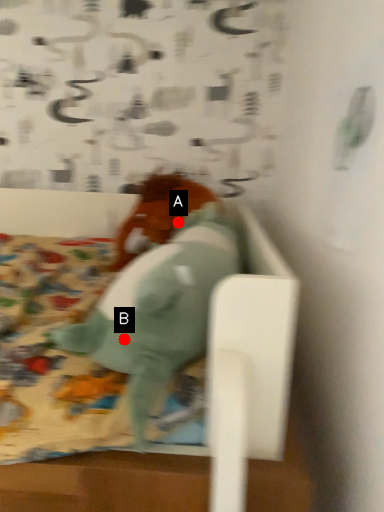
Question: Two points are circled on the image, labeled by A and B beside each circle. Which of the following is the farthest from the observer?

Choices:
 (A) A is further
 (B) B is further

Answer: (A)